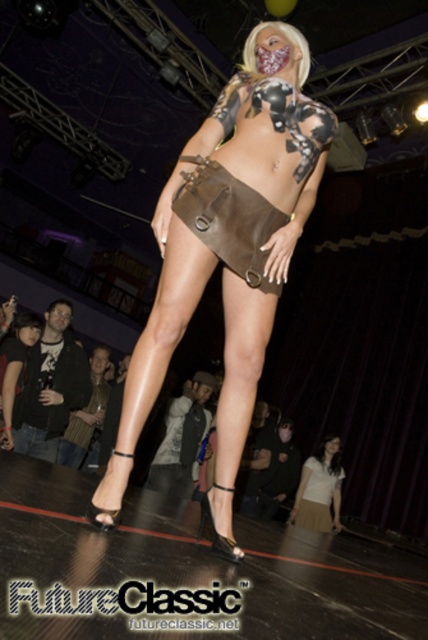
You are a fashion designer observing the runway show. You notice two skirts in the image. The model is wearing a matte brown leather skirt at center and a white matte skirt at lower center. Which skirt is visible on top?

The matte brown leather skirt at center is positioned over the white matte skirt at lower center, making it the visible top layer.